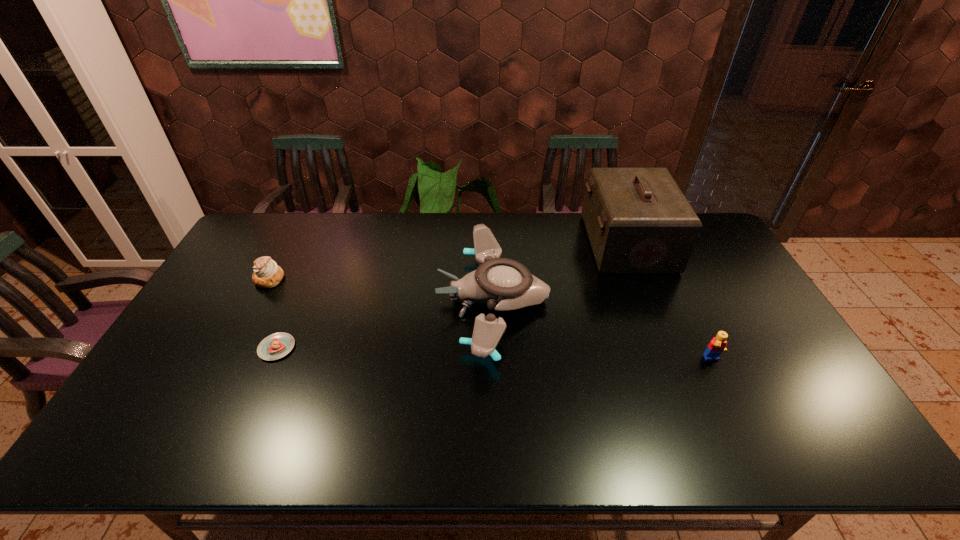
Identify the location of the tallest object. This screenshot has width=960, height=540. (638, 220).

Locate an element on the screen. The image size is (960, 540). the third object from right to left is located at coordinates (503, 284).

Identify the location of Lego. (717, 345).

Where is `the farther pastry`? Image resolution: width=960 pixels, height=540 pixels. the farther pastry is located at coordinates (267, 274).

Image resolution: width=960 pixels, height=540 pixels. In order to click on the left pastry in this screenshot , I will do 267,274.

The image size is (960, 540). Find the location of `the shorter pastry`. the shorter pastry is located at coordinates (278, 345).

Identify the location of the shortest object. The image size is (960, 540). (278, 345).

Where is `vacant area located 0.080m on the right of the tallest object`? This screenshot has height=540, width=960. vacant area located 0.080m on the right of the tallest object is located at coordinates (692, 244).

You are a GUI agent. You are given a task and a screenshot of the screen. Output one action in this format:
    pyautogui.click(x=<x>, y=<y>)
    Task: Click on the blank space located 0.160m on the front-facing side of the drone
    This screenshot has height=540, width=960.
    Given the screenshot: What is the action you would take?
    pyautogui.click(x=386, y=300)

The image size is (960, 540). I want to click on vacant space located 0.390m on the front-facing side of the drone, so click(311, 300).